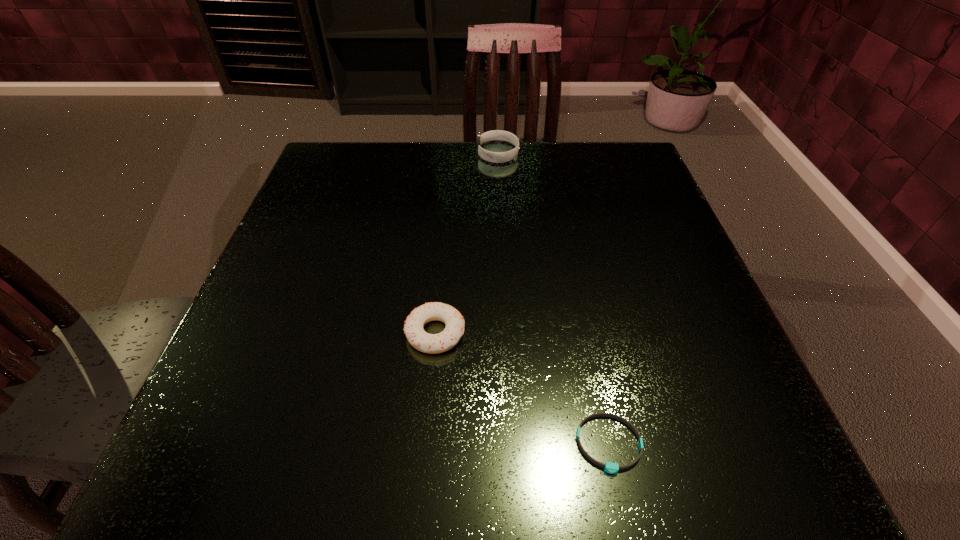
I want to click on object positioned at the far edge, so click(x=497, y=157).

Locate an element on the screen. The image size is (960, 540). object located in the near edge section of the desktop is located at coordinates (609, 467).

Locate an element on the screen. vacant space at the far edge of the desktop is located at coordinates (483, 180).

In the image, there is a desktop. Identify the location of free space at the near edge. (460, 464).

Image resolution: width=960 pixels, height=540 pixels. In the image, there is a desktop. What are the coordinates of `free space at the left edge` in the screenshot? It's located at (356, 224).

This screenshot has width=960, height=540. Find the location of `free space at the right edge of the desktop`. free space at the right edge of the desktop is located at coordinates (710, 370).

Locate an element on the screen. The width and height of the screenshot is (960, 540). blank space at the far left corner of the desktop is located at coordinates (x=327, y=154).

The height and width of the screenshot is (540, 960). Identify the location of vacant area at the near left corner of the desktop. (291, 444).

You are a GUI agent. You are given a task and a screenshot of the screen. Output one action in this format:
    pyautogui.click(x=<x>, y=<y>)
    Task: Click on the vacant space at the near right corner of the desktop
    This screenshot has height=540, width=960.
    Given the screenshot: What is the action you would take?
    pyautogui.click(x=761, y=463)

I want to click on free space between the farthest object and the nearest object, so click(x=553, y=299).